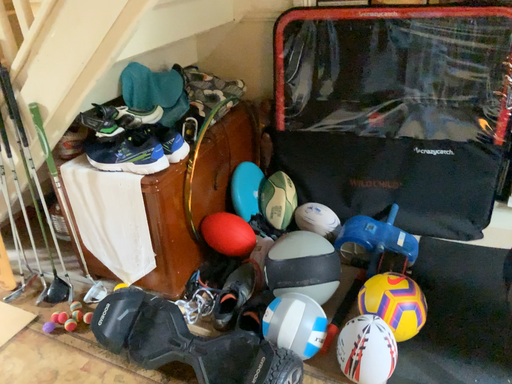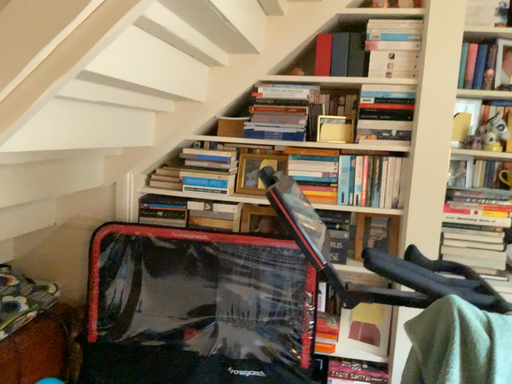
Question: How did the camera likely rotate when shooting the video?

Choices:
 (A) rotated left
 (B) rotated right

Answer: (B)